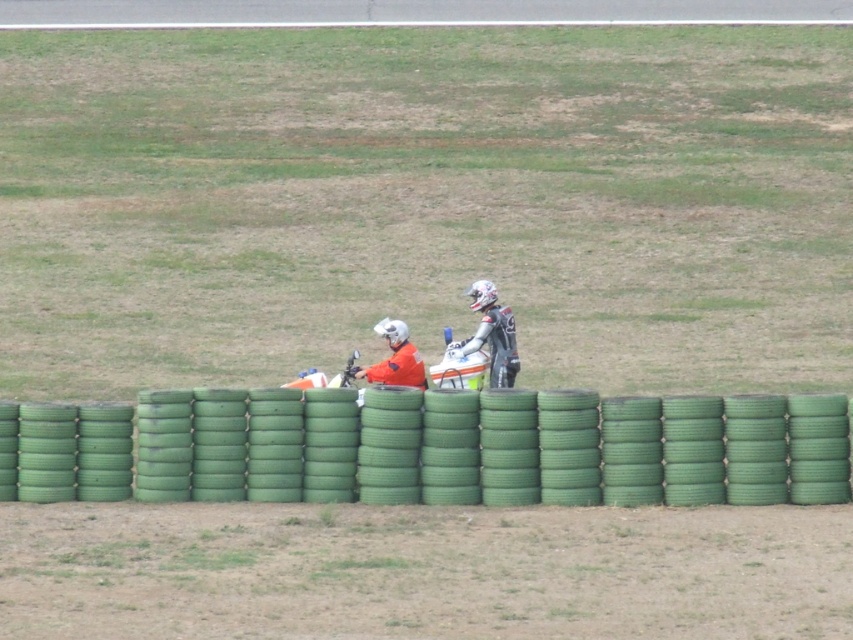
Does asphalt at center appear over orange fabric jacket at center?

Yes.

Who is more forward, [546,10] or [408,368]?

Point [408,368] is more forward.

Which is behind, point (91, 3) or point (407, 365)?

Positioned behind is point (91, 3).

The height and width of the screenshot is (640, 853). I want to click on asphalt at center, so click(x=410, y=12).

Consider the image. Can you confirm if green rubber tires at center is smaller than white matte motorcycle at center?

Actually, green rubber tires at center might be larger than white matte motorcycle at center.

What do you see at coordinates (526, 448) in the screenshot? This screenshot has width=853, height=640. I see `green rubber tires at center` at bounding box center [526, 448].

Where is `green rubber tires at center`? green rubber tires at center is located at coordinates (526, 448).

Between point (740, 416) and point (384, 323), which one is positioned behind?

Positioned behind is point (384, 323).

Consider the image. Does green rubber tires at center appear on the left side of orange fabric jacket at center?

Incorrect, green rubber tires at center is not on the left side of orange fabric jacket at center.

Where is `green rubber tires at center`? This screenshot has height=640, width=853. green rubber tires at center is located at coordinates (526, 448).